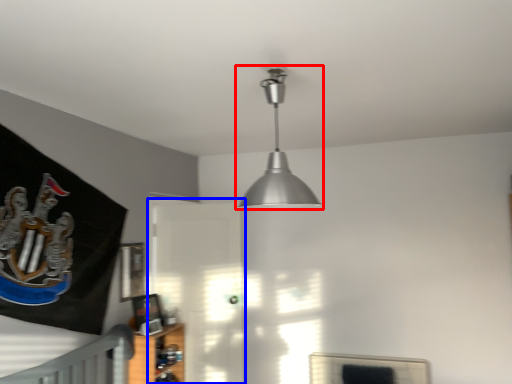
Question: Among these objects, which one is farthest to the camera, lamp (highlighted by a red box) or glass door (highlighted by a blue box)?

Choices:
 (A) lamp
 (B) glass door

Answer: (B)